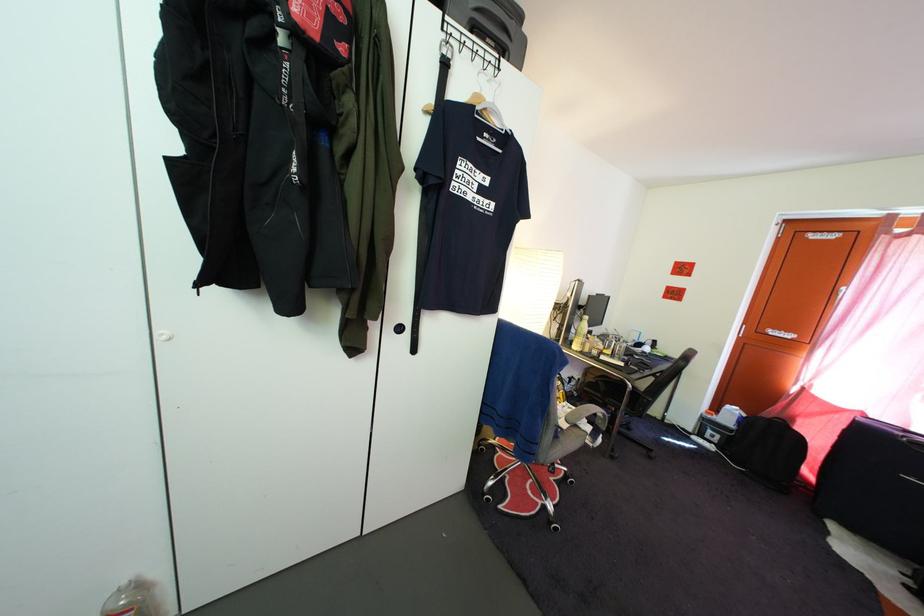
Find where to lift the yellow plastic bottle. Please return your answer as a coordinate pair (x, y).

(579, 334)